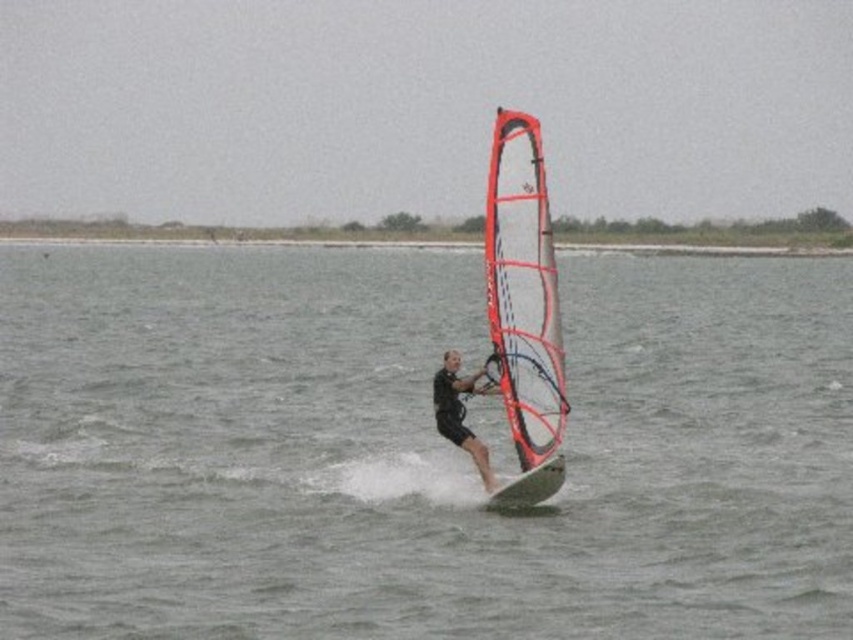
Measure the distance between clear water at center and black matte wetsuit at center.

clear water at center is 39.58 feet from black matte wetsuit at center.

Which is more to the right, clear water at center or black matte wetsuit at center?

black matte wetsuit at center is more to the right.

Which is behind, point (459, 541) or point (451, 364)?

The point (451, 364) is more distant.

Image resolution: width=853 pixels, height=640 pixels. In order to click on clear water at center in this screenshot , I will do `click(415, 451)`.

Can you confirm if clear water at center is shorter than transparent fabric sail at center?

In fact, clear water at center may be taller than transparent fabric sail at center.

Does clear water at center have a lesser width compared to transparent fabric sail at center?

No, clear water at center is not thinner than transparent fabric sail at center.

What do you see at coordinates (415, 451) in the screenshot? I see `clear water at center` at bounding box center [415, 451].

I want to click on clear water at center, so click(x=415, y=451).

Does transparent fabric sail at center have a larger size compared to black matte wetsuit at center?

Indeed, transparent fabric sail at center has a larger size compared to black matte wetsuit at center.

Can you confirm if transparent fabric sail at center is taller than black matte wetsuit at center?

Yes, transparent fabric sail at center is taller than black matte wetsuit at center.

The width and height of the screenshot is (853, 640). I want to click on transparent fabric sail at center, so click(524, 307).